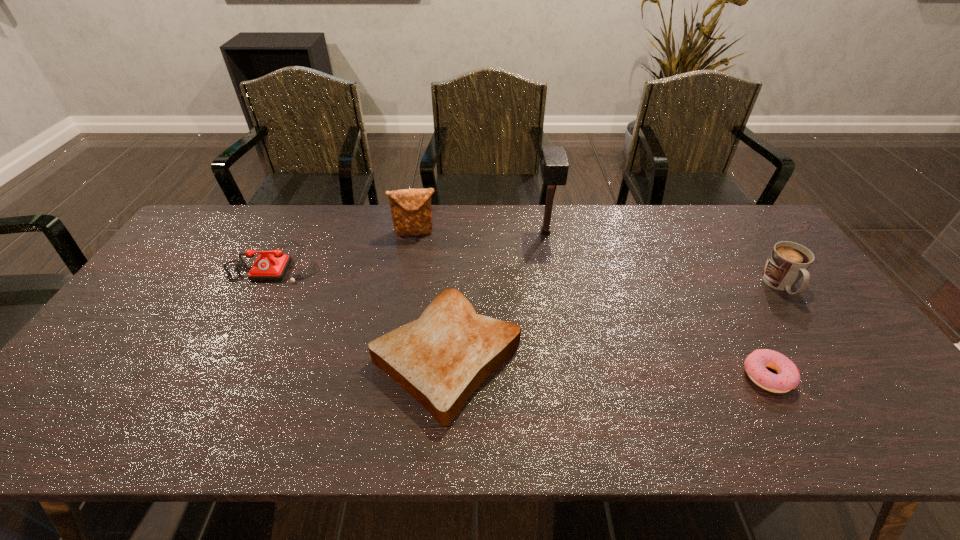
Locate an element on the screen. vacant space that's between the shortest object and the second shortest object is located at coordinates (607, 367).

The width and height of the screenshot is (960, 540). Find the location of `free space between the fifth tallest object and the mug`. free space between the fifth tallest object and the mug is located at coordinates (613, 321).

Image resolution: width=960 pixels, height=540 pixels. Find the location of `vacant space that is in between the rightmost object and the shortest object`. vacant space that is in between the rightmost object and the shortest object is located at coordinates (774, 331).

This screenshot has width=960, height=540. I want to click on free spot between the bread and the tallest object, so click(496, 295).

The height and width of the screenshot is (540, 960). Identify the location of empty space that is in between the second tallest object and the fourth tallest object. (345, 247).

Identify which object is located as the second nearest to the mug. Please provide its 2D coordinates. Your answer should be formatted as a tuple, i.e. [(x, y)], where the tuple contains the x and y coordinates of a point satisfying the conditions above.

[(554, 166)]

In order to click on object that is the fourth closest to the shortest object in this screenshot , I will do `click(411, 211)`.

Locate an element on the screen. The width and height of the screenshot is (960, 540). vacant area that satisfies the following two spatial constraints: 1. on the dial of the fifth object from left to right; 2. on the left side of the fourth tallest object is located at coordinates (216, 376).

This screenshot has height=540, width=960. Identify the location of free point that satisfies the following two spatial constraints: 1. on the dial of the bread; 2. on the left side of the fourth tallest object. (226, 357).